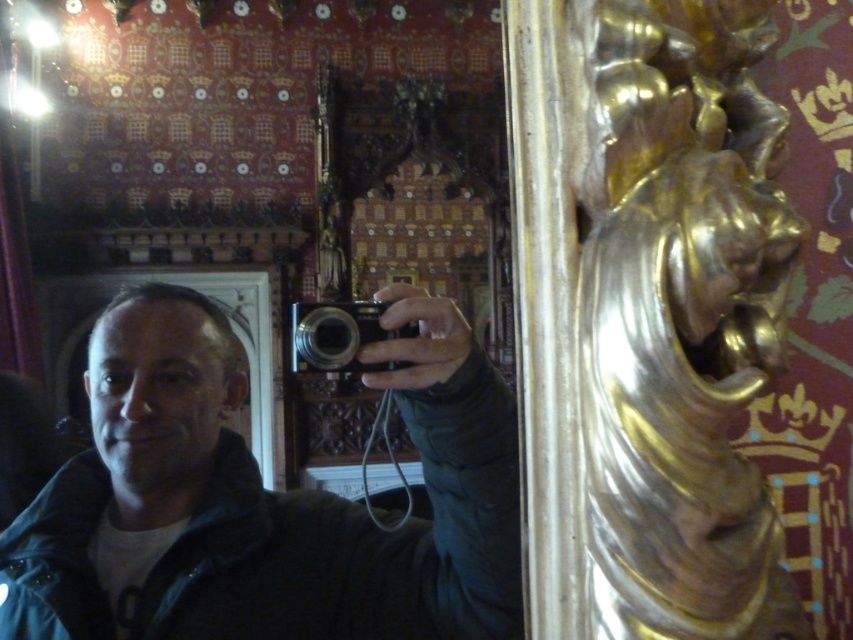
You are a photographer who wants to choose between the matte black camera at center and the black plastic camera at center based on their sizes. Which one is smaller?

The matte black camera at center is smaller than the black plastic camera at center.

You are an interior designer observing the room and want to place a new decorative item between the matte black camera at center and the black plastic camera at center. Which camera should you place the item closer to, the one that is nearer to you or the one further away?

The matte black camera at center is closer to you than the black plastic camera at center, so you should place the decorative item closer to the matte black camera at center if you want it nearer to your position.